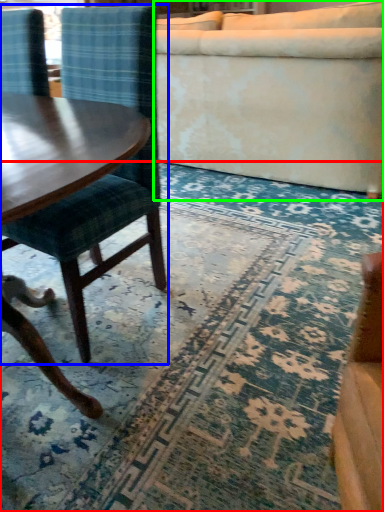
Question: Which is nearer to the mat (highlighted by a red box)? chair (highlighted by a blue box) or studio couch (highlighted by a green box).

Choices:
 (A) chair
 (B) studio couch

Answer: (A)